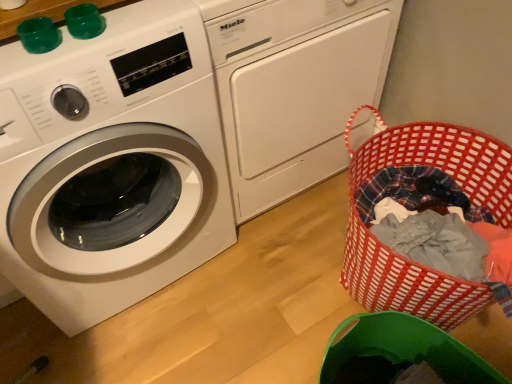
Question: From a real-world perspective, is white glossy washing machine at left, which ranks as the first washing machine in left-to-right order, beneath red woven laundry basket at lower right?

Choices:
 (A) yes
 (B) no

Answer: (B)

Question: From a real-world perspective, does white glossy washing machine at left, the second washing machine from the right, stand above red woven laundry basket at lower right?

Choices:
 (A) no
 (B) yes

Answer: (B)

Question: Is white glossy washing machine at left, which ranks as the first washing machine in left-to-right order, beside red woven laundry basket at lower right?

Choices:
 (A) yes
 (B) no

Answer: (B)

Question: Considering the relative sizes of white glossy washing machine at left, which ranks as the first washing machine in left-to-right order, and red woven laundry basket at lower right in the image provided, is white glossy washing machine at left, which ranks as the first washing machine in left-to-right order, thinner than red woven laundry basket at lower right?

Choices:
 (A) yes
 (B) no

Answer: (B)

Question: Does white glossy washing machine at left, the second washing machine from the right, have a greater height compared to red woven laundry basket at lower right?

Choices:
 (A) yes
 (B) no

Answer: (A)

Question: From the image's perspective, does white glossy washing machine at left, which ranks as the first washing machine in left-to-right order, appear higher than red woven laundry basket at lower right?

Choices:
 (A) yes
 (B) no

Answer: (A)

Question: Is red woven laundry basket at lower right not close to white glossy washing machine at left, the second washing machine from the right?

Choices:
 (A) no
 (B) yes

Answer: (A)

Question: Can you confirm if red woven laundry basket at lower right is taller than white glossy washing machine at left, which ranks as the first washing machine in left-to-right order?

Choices:
 (A) yes
 (B) no

Answer: (B)

Question: Does red woven laundry basket at lower right come behind white glossy washing machine at left, which ranks as the first washing machine in left-to-right order?

Choices:
 (A) no
 (B) yes

Answer: (B)

Question: Is red woven laundry basket at lower right next to white glossy washing machine at left, which ranks as the first washing machine in left-to-right order?

Choices:
 (A) no
 (B) yes

Answer: (A)

Question: Would you say white glossy washing machine at left, which ranks as the first washing machine in left-to-right order, is part of red woven laundry basket at lower right's contents?

Choices:
 (A) yes
 (B) no

Answer: (B)

Question: From the image's perspective, is red woven laundry basket at lower right above white glossy washing machine at left, which ranks as the first washing machine in left-to-right order?

Choices:
 (A) yes
 (B) no

Answer: (B)

Question: From a real-world perspective, does white glossy washing machine at left, the first washing machine when ordered from right to left, stand above red woven laundry basket at lower right?

Choices:
 (A) yes
 (B) no

Answer: (A)